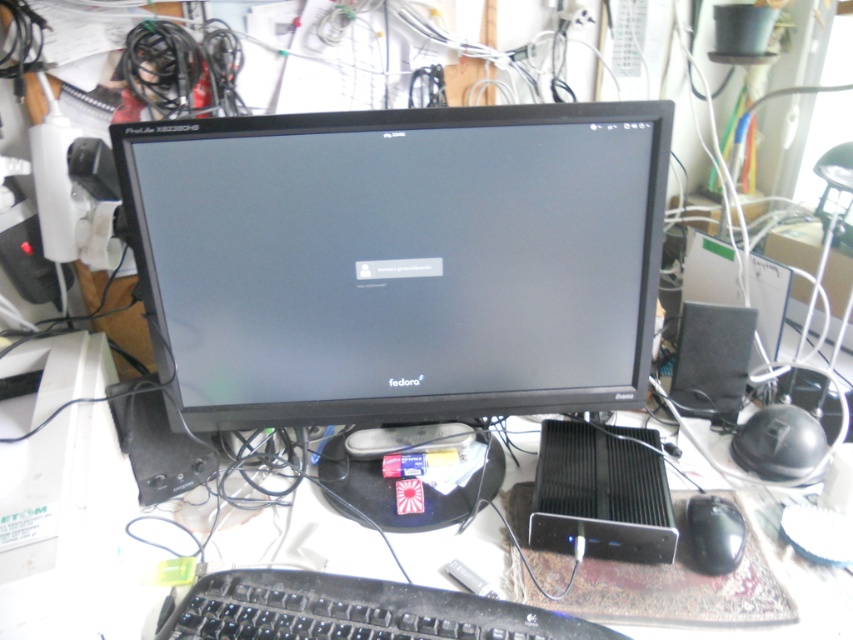
Question: Based on their relative distances, which object is farther from the black matte monitor at center?

Choices:
 (A) black matte mouse at lower right
 (B) black plastic keyboard at lower center
 (C) black matte computer at center

Answer: (A)

Question: Is black matte computer at center thinner than black matte mouse at lower right?

Choices:
 (A) no
 (B) yes

Answer: (A)

Question: Among these objects, which one is nearest to the camera?

Choices:
 (A) black matte mouse at lower right
 (B) black matte computer at center
 (C) black plastic keyboard at lower center

Answer: (C)

Question: Does black plastic keyboard at lower center appear under black matte mouse at lower right?

Choices:
 (A) yes
 (B) no

Answer: (A)

Question: Which of these objects is positioned farthest from the black plastic keyboard at lower center?

Choices:
 (A) black matte computer at center
 (B) black matte mouse at lower right
 (C) black matte monitor at center

Answer: (B)

Question: Can you confirm if black matte monitor at center is positioned to the right of black matte mouse at lower right?

Choices:
 (A) yes
 (B) no

Answer: (B)